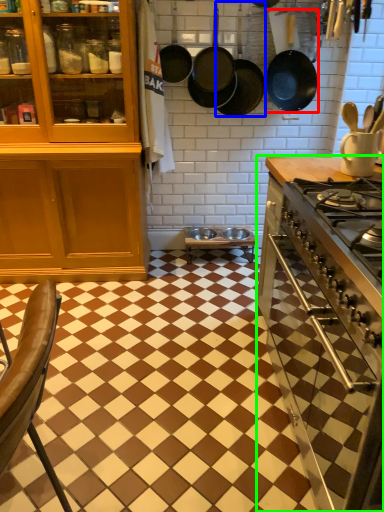
Question: Which object is positioned closest to frying pan (highlighted by a red box)? Select from frying pan (highlighted by a blue box) and countertop (highlighted by a green box).

Choices:
 (A) frying pan
 (B) countertop

Answer: (A)